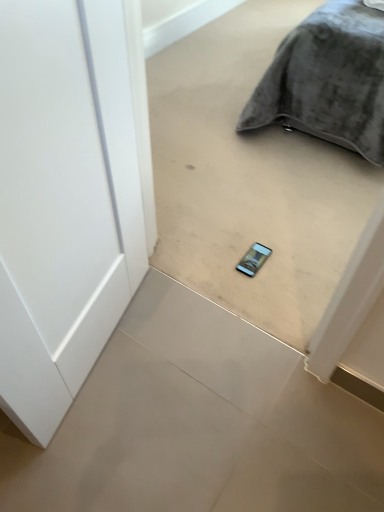
What are the coordinates of `free space above white glossy concrete at center, the second concrete positioned from the top (from a real-world perspective)` in the screenshot? It's located at (184, 419).